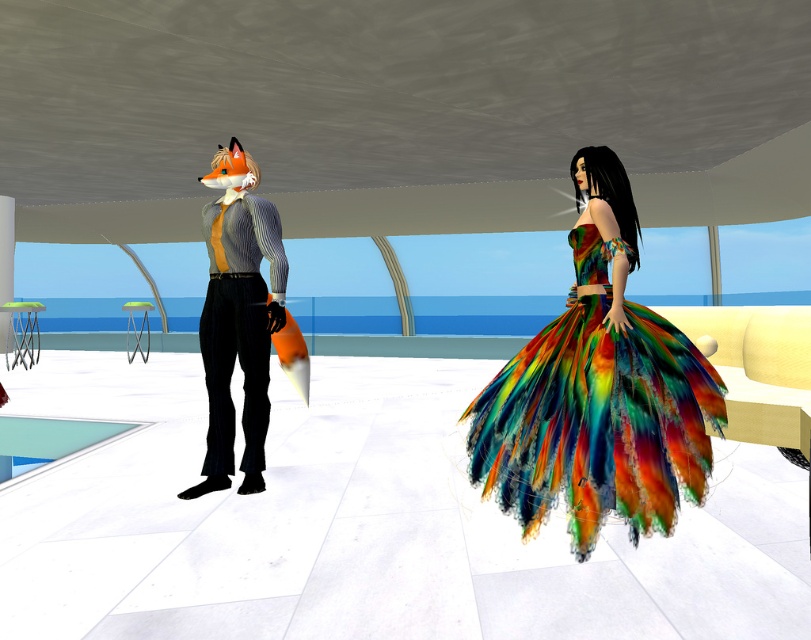
Based on the photo, you are a fashion designer observing the two items in the scene. The rainbow feather dress at center and the matte striped shirt at center are both placed on a mannequin. Which item would require a wider display stand to accommodate its width?

The rainbow feather dress at center might be wider than the matte striped shirt at center, so it would require a wider display stand.

You are standing in the room and see the rainbow feather dress at center and the matte striped shirt at center. Which one is positioned more to the right side of the room?

The rainbow feather dress at center is positioned more to the right side of the room than the matte striped shirt at center.